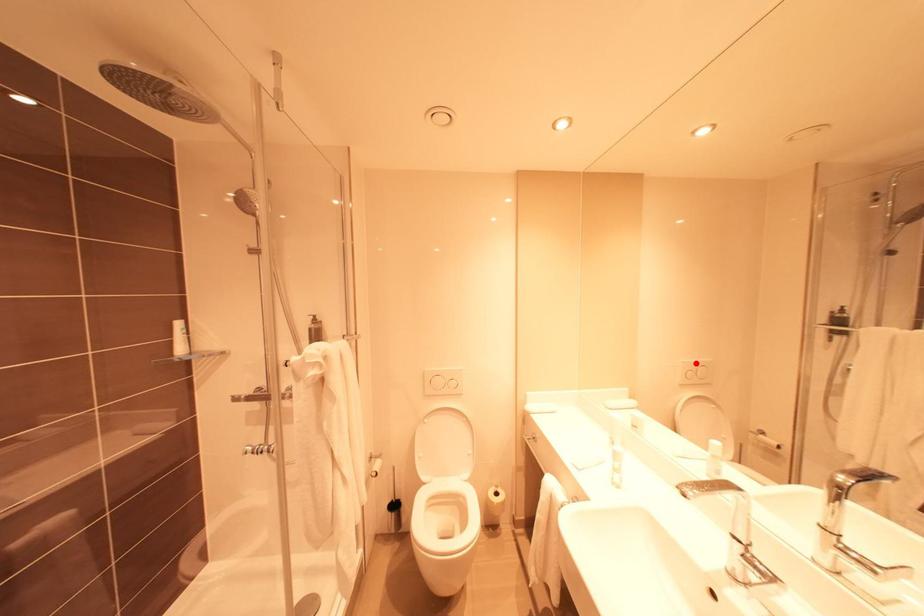
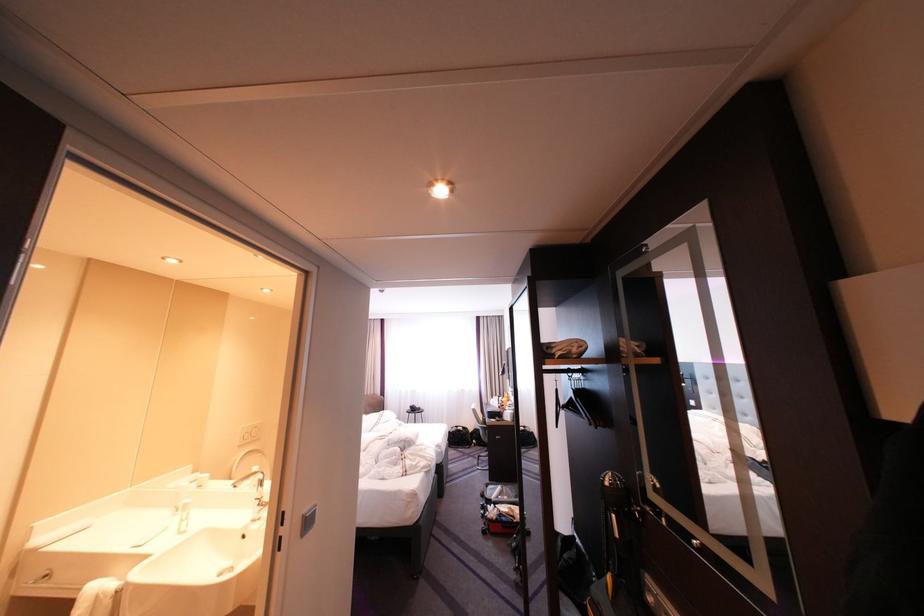
Where in the second image is the point corresponding to the highlighted location from the first image?

(254, 429)